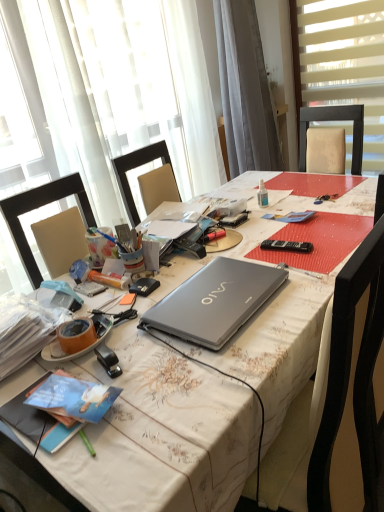
Locate an element on the screen. This screenshot has height=512, width=384. vacant area that lies between silver metallic laptop at center and black plastic stapler at lower left is located at coordinates (152, 351).